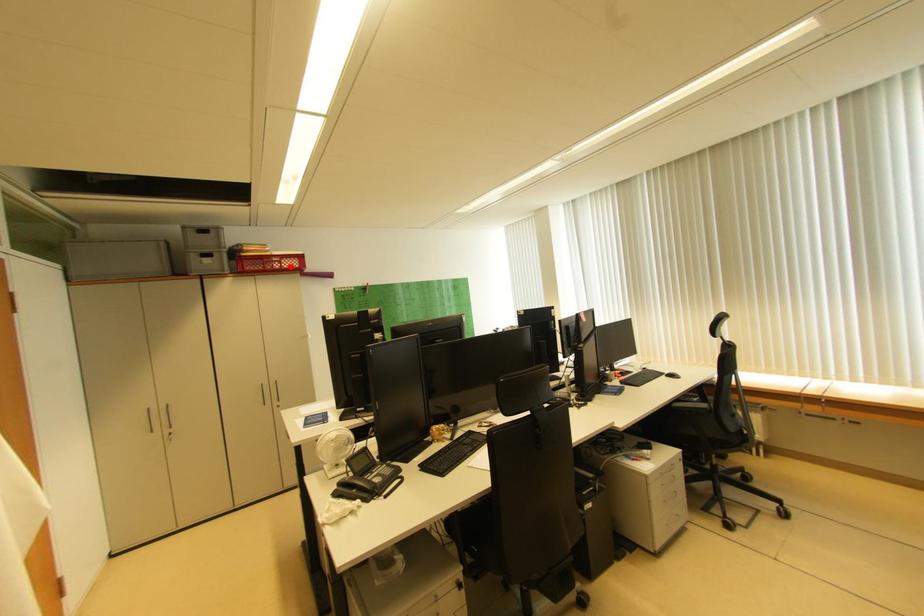
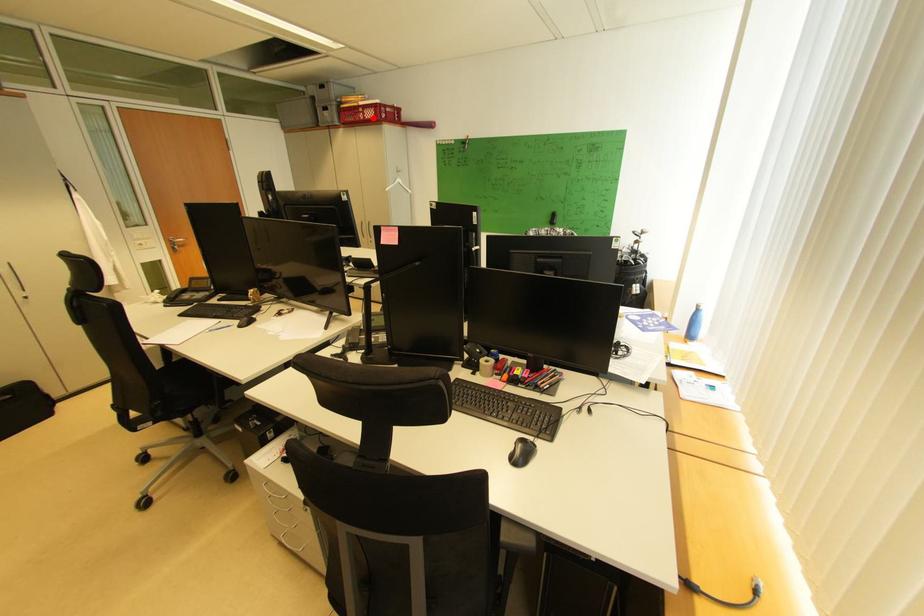
I am providing you with two images of the same scene from different viewpoints. A red point is marked on the first image and another point is marked on the second image. Are the points marked in image1 and image2 representing the same 3D position?

Yes